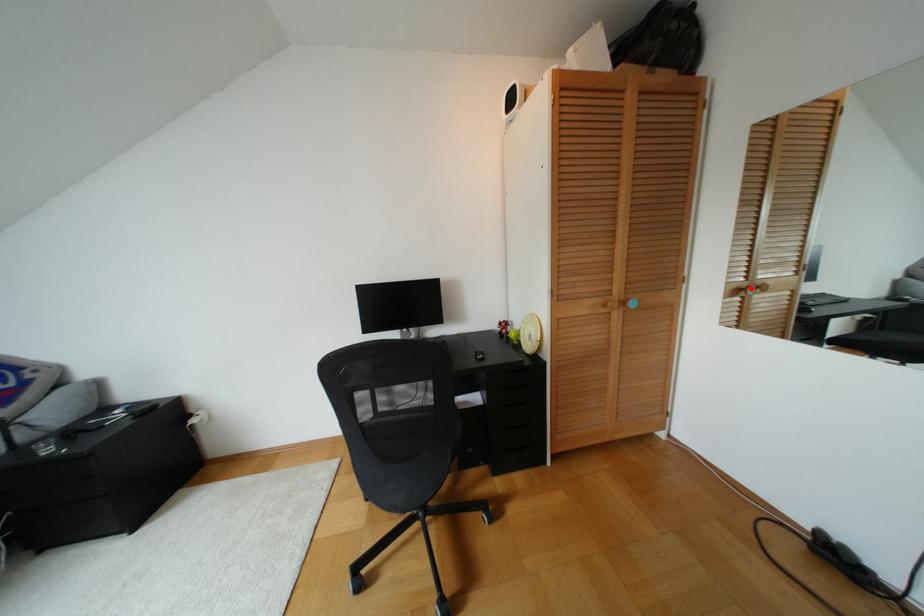
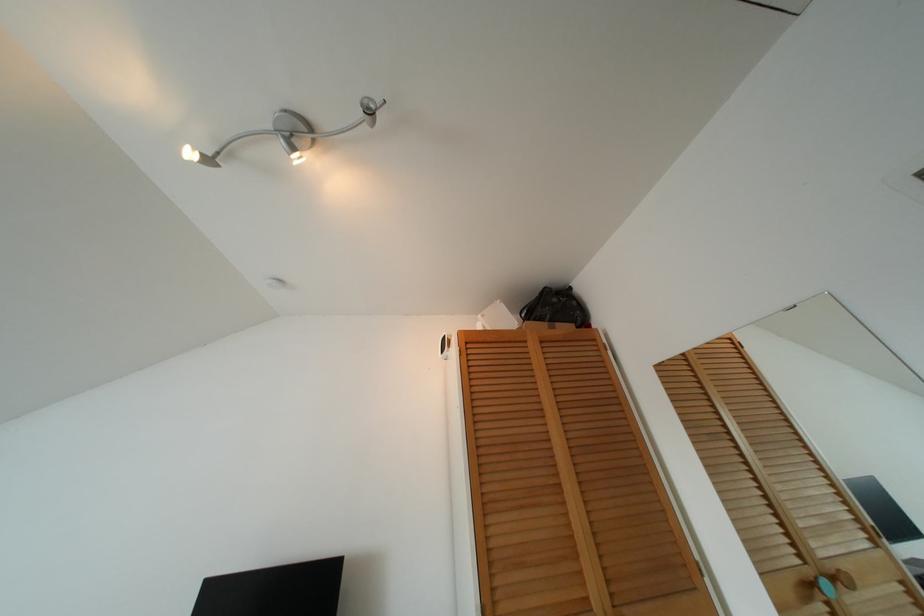
Find the pixel in the second image that matches the highlighted location in the first image.

(825, 585)